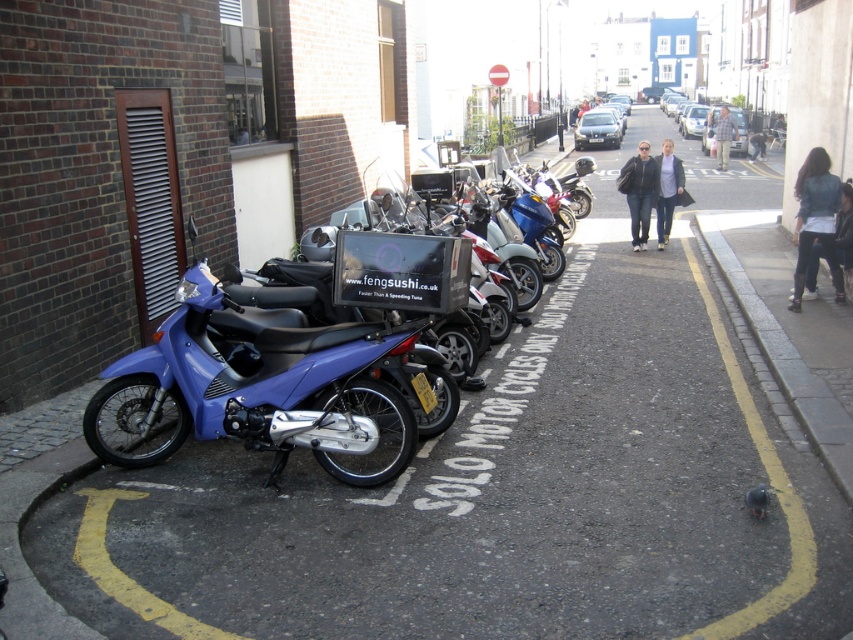
You are a delivery person trying to park your matte blue motorcycle at left near the curb. According to the pavement markings, solo motorcyclists are allowed. Is your motorcycle positioned correctly relative to the gray concrete curb at lower right?

The matte blue motorcycle at left is below the gray concrete curb at lower right, so it is positioned correctly as it is near the curb where solo motorcyclists can park.

You are a delivery driver who needs to park your motorcycle on the curb. The matte blue motorcycle at left and the gray concrete curb at lower right are in your path. Can you park your motorcycle between them without overlapping either?

The matte blue motorcycle at left is positioned on the left side of gray concrete curb at lower right, so there is space between them. You can park your motorcycle between the matte blue motorcycle at left and the gray concrete curb at lower right as long as you stay within the available space.

You are a delivery driver who needs to park your motorcycle between the matte blue motorcycle at left and the gray concrete curb at lower right. Your motorcycle is 2 meters long. Is there enough space between them for your motorcycle?

The distance between the matte blue motorcycle at left and the gray concrete curb at lower right is 3.76 meters. Since your motorcycle is only 2 meters long, there is sufficient space to park between them.